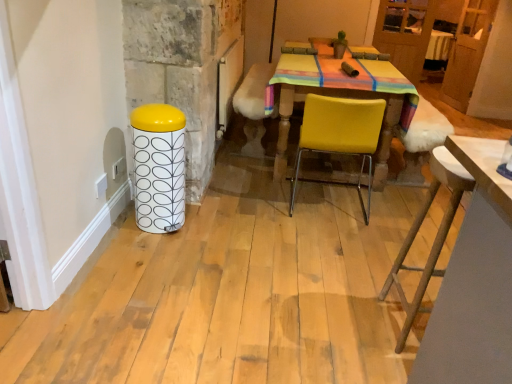
The height and width of the screenshot is (384, 512). In order to click on free point below yellow matte chair at center (from a real-world perspective) in this screenshot , I will do `click(325, 204)`.